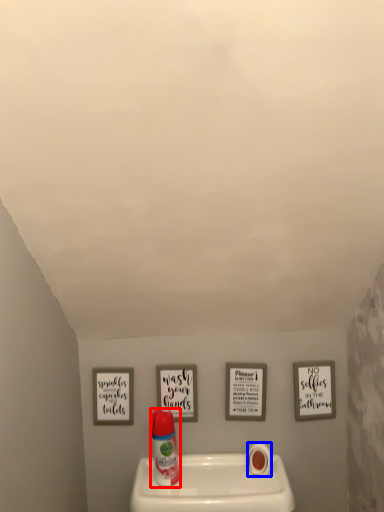
Question: Among these objects, which one is farthest to the camera, cleaning product (highlighted by a red box) or toilet paper (highlighted by a blue box)?

Choices:
 (A) cleaning product
 (B) toilet paper

Answer: (B)